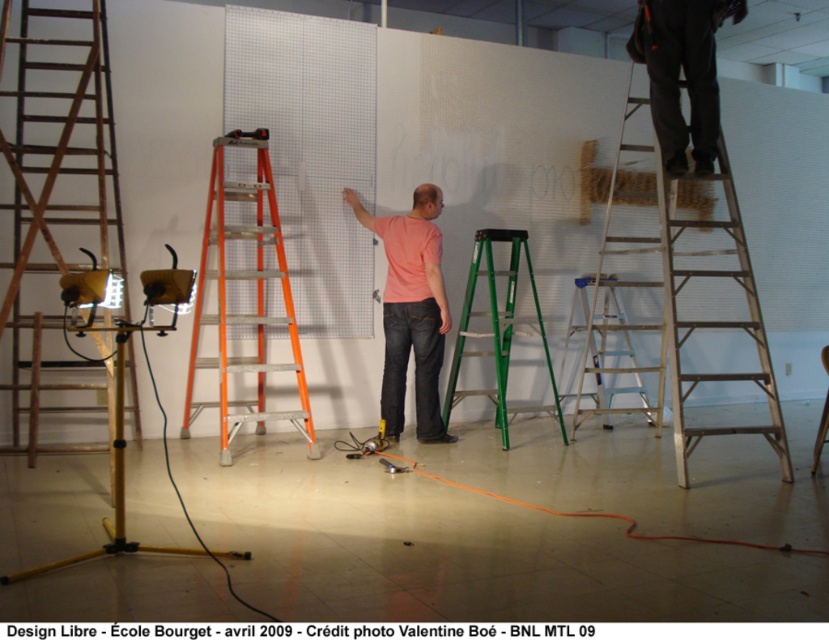
You are an interior designer assessing the workspace. You need to determine if the pink matte shirt at center can be hung on the metallic silver ladder at center without bending the ladder. Based on their sizes, is this feasible?

The pink matte shirt at center is thinner than the metallic silver ladder at center, so it can be hung on the ladder without bending it.

Consider the image. You are standing in the workspace and want to reach a tool located at point (45, 349). The ladders available are an orange ladder, a green ladder, and two metallic ladders. Which ladder is closest to the point where the tool is located?

The orange ladder is closest to the point (45, 349).

From the picture: You are an interior designer assessing the workspace. You notice the pink matte shirt at center and the metallic silver ladder at center. Which object occupies a larger physical space in the room?

The metallic silver ladder at center occupies a larger physical space in the room compared to the pink matte shirt at center, as the description states that the pink matte shirt at center is smaller in size.